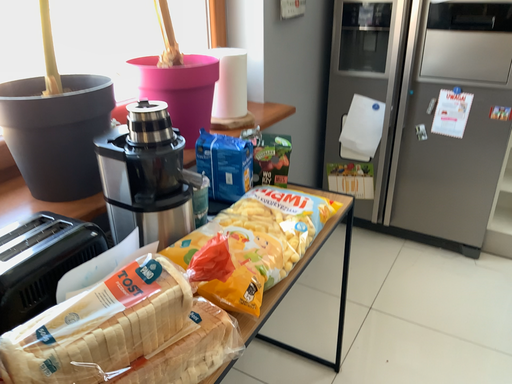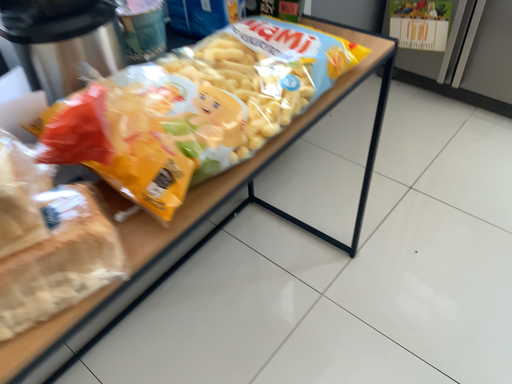
Question: Which way did the camera rotate in the video?

Choices:
 (A) rotated left
 (B) rotated right

Answer: (A)